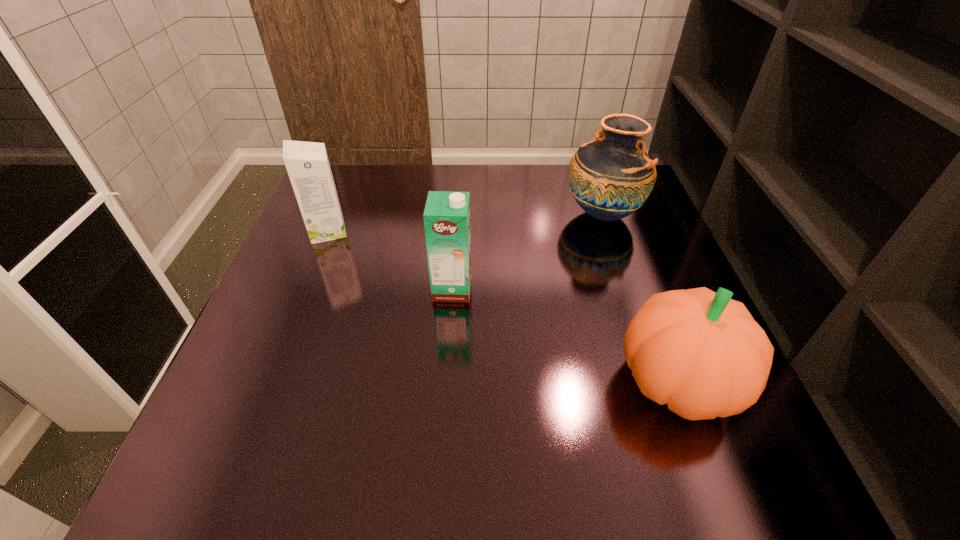
This screenshot has width=960, height=540. In order to click on object that stands as the second closest to the nearest object in this screenshot , I will do `click(610, 177)`.

Locate an element on the screen. The width and height of the screenshot is (960, 540). object that is the third closest to the pottery is located at coordinates (307, 164).

Where is `free region that satisfies the following two spatial constraints: 1. on the front side of the right carton; 2. on the left side of the pumpkin`? The width and height of the screenshot is (960, 540). free region that satisfies the following two spatial constraints: 1. on the front side of the right carton; 2. on the left side of the pumpkin is located at coordinates (446, 382).